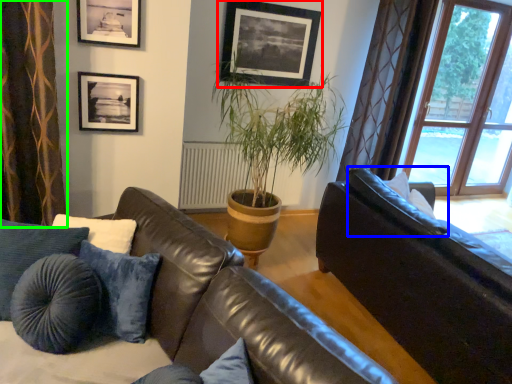
Question: Which object is positioned farthest from picture frame (highlighted by a red box)? Select from pillow (highlighted by a blue box) and curtain (highlighted by a green box).

Choices:
 (A) pillow
 (B) curtain

Answer: (B)